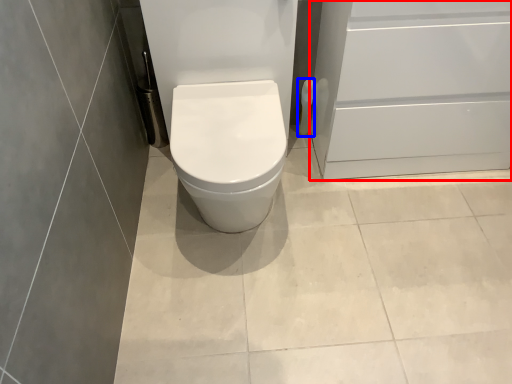
Question: Among these objects, which one is farthest to the camera, screen door (highlighted by a red box) or toilet paper (highlighted by a blue box)?

Choices:
 (A) screen door
 (B) toilet paper

Answer: (B)